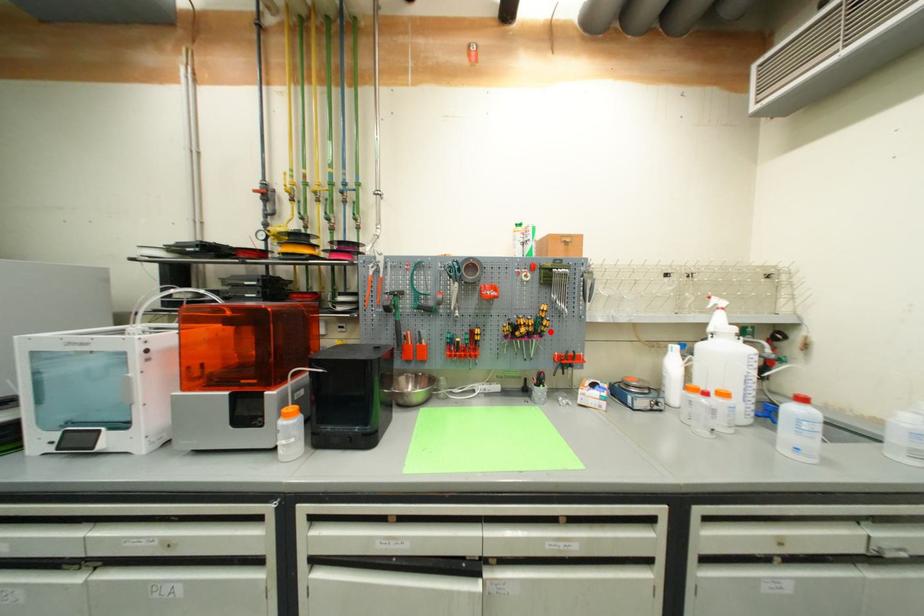
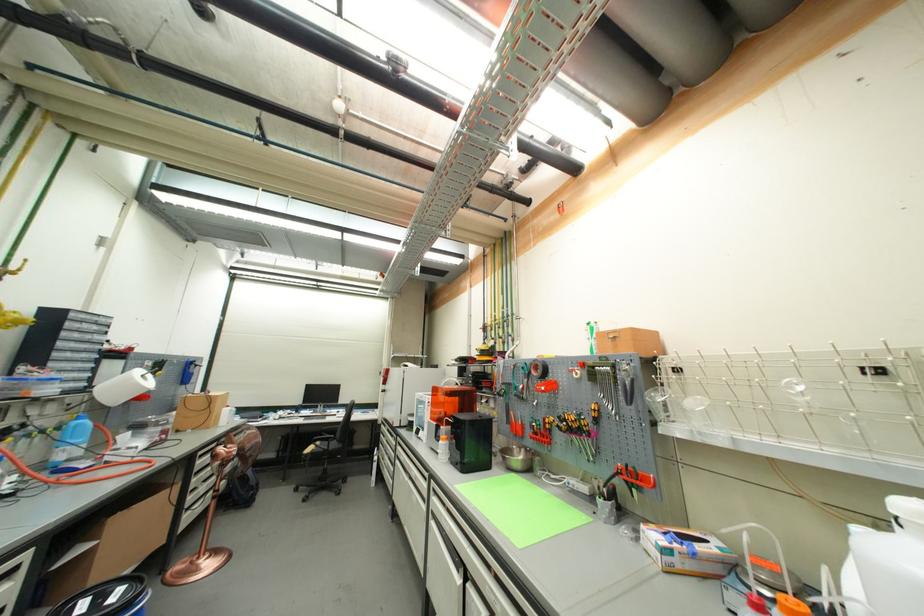
In the second image, find the point that corresponds to the highlighted location in the first image.

(592, 431)